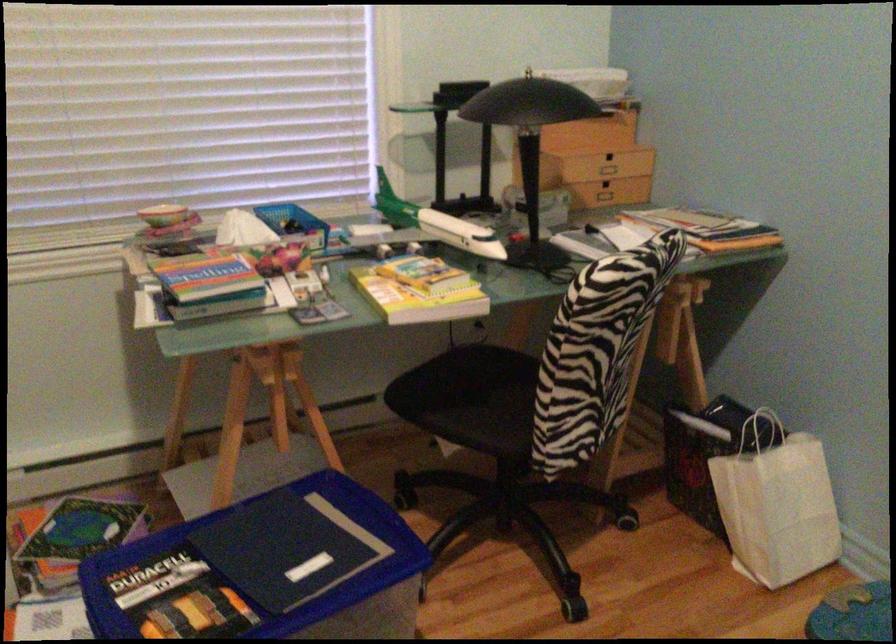
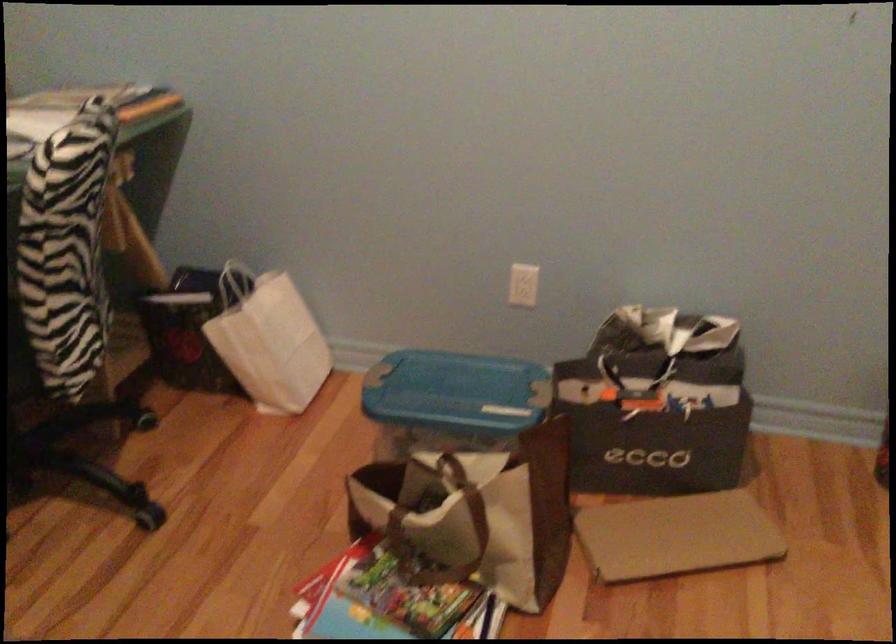
Find the pixel in the second image that matches pixel 760 424 in the first image.

(236, 281)